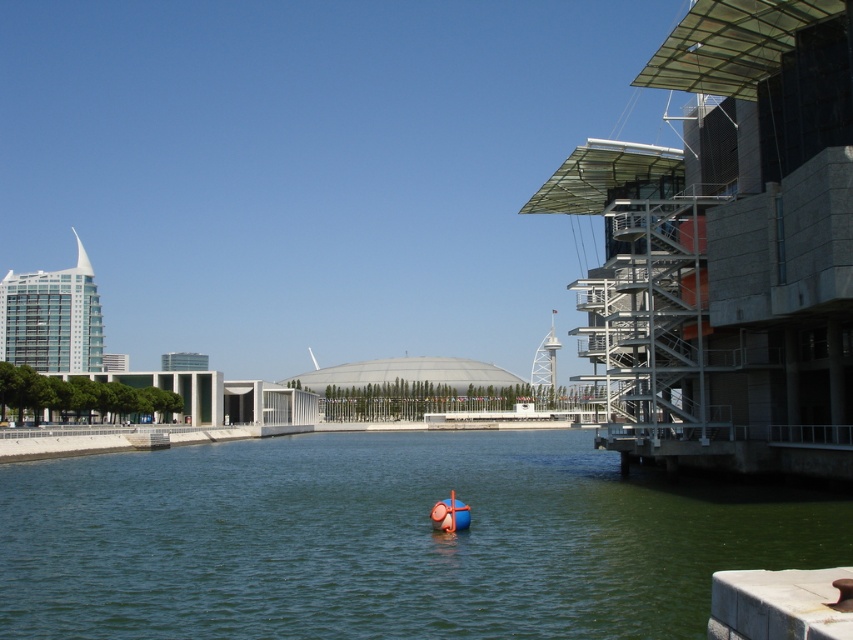
You are a swimmer looking to enter the water. You see the green water at center and the orange rubber boat at center. Which one is closer to you?

The green water at center is closer to you because it is positioned in front of the orange rubber boat at center.